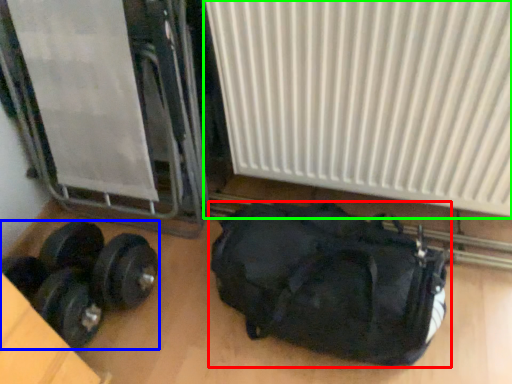
Question: Which object is the farthest from luggage and bags (highlighted by a red box)? Choose among these: dumbbell (highlighted by a blue box) or radiator (highlighted by a green box).

Choices:
 (A) dumbbell
 (B) radiator

Answer: (A)